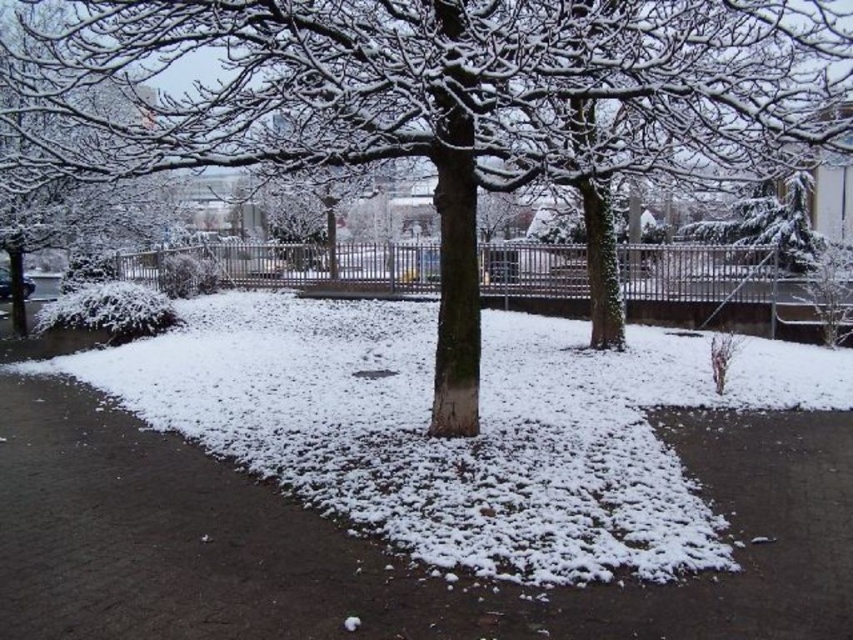
You are standing at the point marked as point (421, 484) in the winter scene. What type of surface are you currently standing on?

The point (421, 484) is located on brown asphalt pavement at center, so you are standing on asphalt pavement.